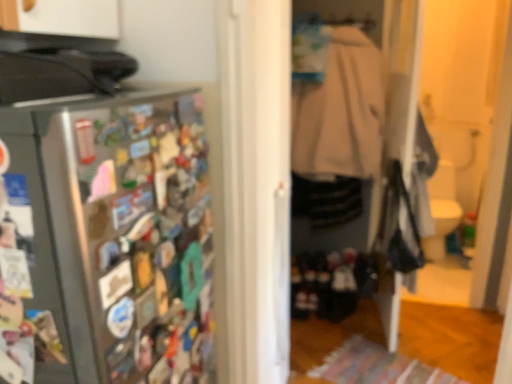
Question: Do you think beige fabric coat at center is within satin silver refrigerator at left, or outside of it?

Choices:
 (A) inside
 (B) outside

Answer: (B)

Question: In the image, is beige fabric coat at center on the left side or the right side of satin silver refrigerator at left?

Choices:
 (A) left
 (B) right

Answer: (B)

Question: From the image's perspective, is beige fabric coat at center positioned above or below satin silver refrigerator at left?

Choices:
 (A) below
 (B) above

Answer: (B)

Question: Considering the positions of satin silver refrigerator at left and beige fabric coat at center in the image, is satin silver refrigerator at left wider or thinner than beige fabric coat at center?

Choices:
 (A) wide
 (B) thin

Answer: (A)

Question: In the image, is satin silver refrigerator at left on the left side or the right side of beige fabric coat at center?

Choices:
 (A) right
 (B) left

Answer: (B)

Question: From a real-world perspective, is satin silver refrigerator at left positioned above or below beige fabric coat at center?

Choices:
 (A) above
 (B) below

Answer: (B)

Question: Based on their sizes in the image, would you say satin silver refrigerator at left is bigger or smaller than beige fabric coat at center?

Choices:
 (A) big
 (B) small

Answer: (A)